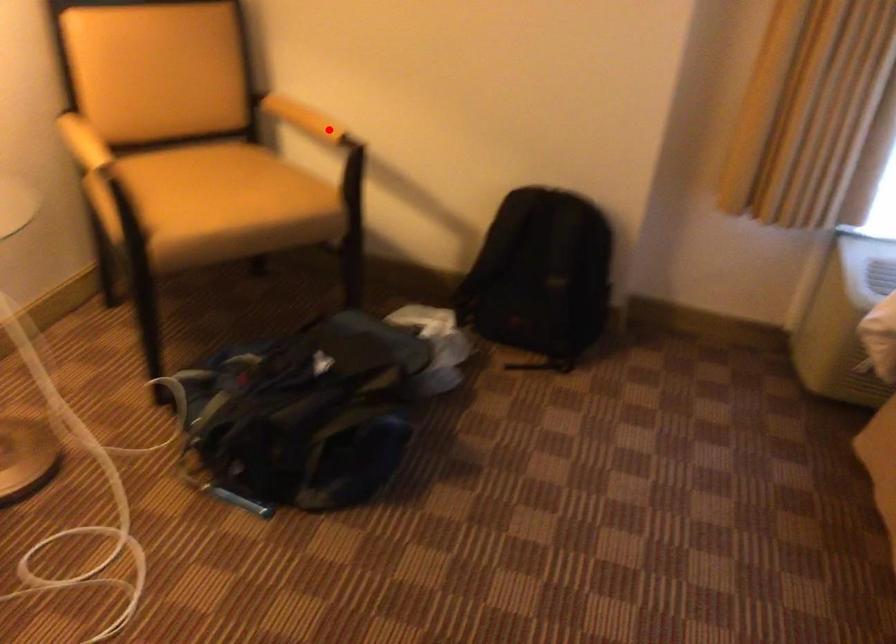
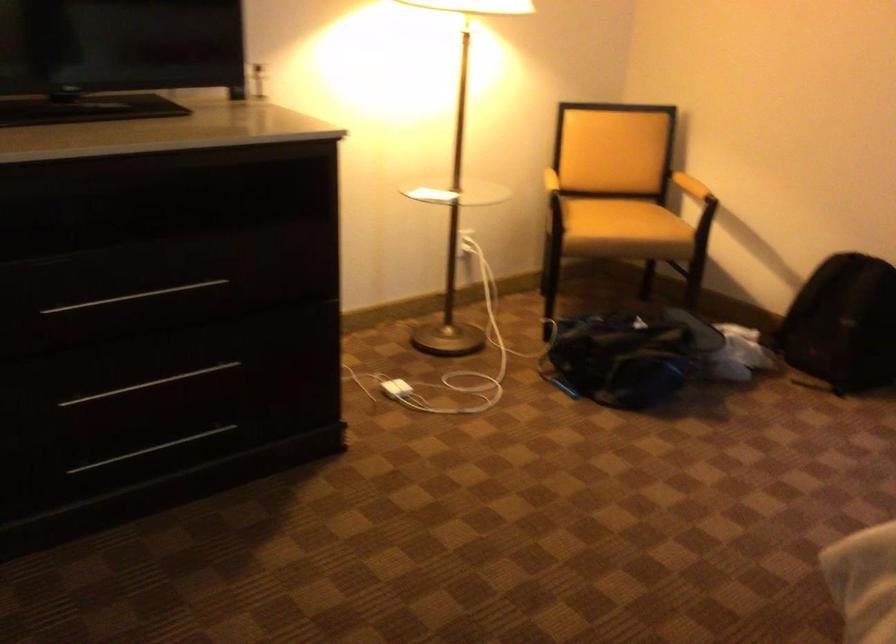
The point at the highlighted location is marked in the first image. Where is the corresponding point in the second image?

(690, 185)